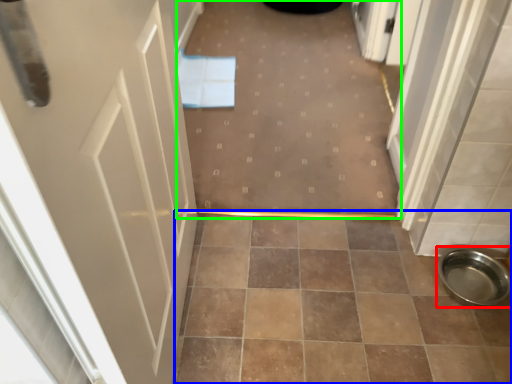
Question: Considering the real-world distances, which object is farthest from toilet bowl (highlighted by a red box)? ceramic tile (highlighted by a blue box) or plain (highlighted by a green box)?

Choices:
 (A) ceramic tile
 (B) plain

Answer: (B)